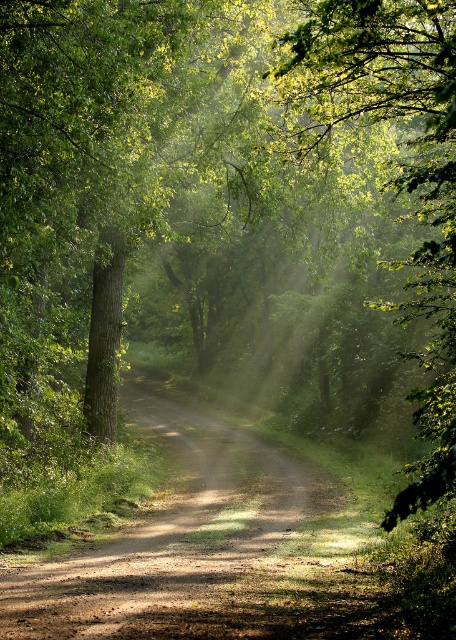
Question: Does dirt road at center appear under green leafy tree at center?

Choices:
 (A) no
 (B) yes

Answer: (B)

Question: Is dirt road at center further to the viewer compared to green leafy tree at center?

Choices:
 (A) yes
 (B) no

Answer: (A)

Question: Which point appears farthest from the camera in this image?

Choices:
 (A) (454, 269)
 (B) (328, 616)

Answer: (A)

Question: Is dirt road at center further to camera compared to green leafy tree at center?

Choices:
 (A) yes
 (B) no

Answer: (A)